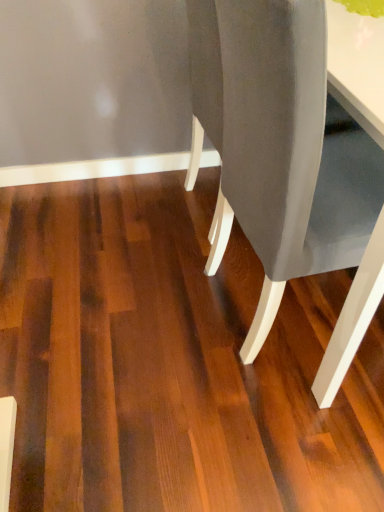
Question: Could dark brown wood floor at center be considered to be inside matte gray chair at center?

Choices:
 (A) no
 (B) yes

Answer: (A)

Question: Is matte gray chair at center to the left of dark brown wood floor at center from the viewer's perspective?

Choices:
 (A) no
 (B) yes

Answer: (A)

Question: From the image's perspective, is matte gray chair at center below dark brown wood floor at center?

Choices:
 (A) yes
 (B) no

Answer: (B)

Question: From a real-world perspective, is matte gray chair at center over dark brown wood floor at center?

Choices:
 (A) no
 (B) yes

Answer: (B)

Question: Does matte gray chair at center touch dark brown wood floor at center?

Choices:
 (A) yes
 (B) no

Answer: (B)

Question: Is matte gray chair at center completely or partially outside of dark brown wood floor at center?

Choices:
 (A) no
 (B) yes

Answer: (B)

Question: Does dark brown wood floor at center have a lesser height compared to matte gray chair at center?

Choices:
 (A) no
 (B) yes

Answer: (B)

Question: Is the depth of dark brown wood floor at center greater than that of matte gray chair at center?

Choices:
 (A) yes
 (B) no

Answer: (A)

Question: From a real-world perspective, is dark brown wood floor at center on matte gray chair at center?

Choices:
 (A) yes
 (B) no

Answer: (B)

Question: Is dark brown wood floor at center in front of matte gray chair at center?

Choices:
 (A) no
 (B) yes

Answer: (A)

Question: Does dark brown wood floor at center have a greater height compared to matte gray chair at center?

Choices:
 (A) yes
 (B) no

Answer: (B)

Question: From the image's perspective, would you say dark brown wood floor at center is positioned over matte gray chair at center?

Choices:
 (A) no
 (B) yes

Answer: (A)

Question: Is dark brown wood floor at center spatially inside matte gray chair at center, or outside of it?

Choices:
 (A) inside
 (B) outside

Answer: (B)